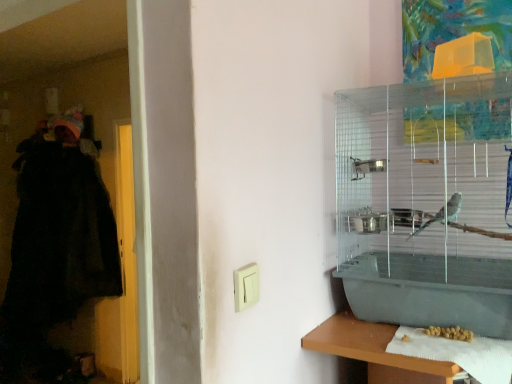
Question: From a real-world perspective, is black fuzzy robe at left over yellow matte seeds at lower right?

Choices:
 (A) yes
 (B) no

Answer: (A)

Question: Does black fuzzy robe at left have a greater width compared to yellow matte seeds at lower right?

Choices:
 (A) no
 (B) yes

Answer: (B)

Question: Does black fuzzy robe at left have a lesser height compared to yellow matte seeds at lower right?

Choices:
 (A) yes
 (B) no

Answer: (B)

Question: Considering the relative positions of black fuzzy robe at left and yellow matte seeds at lower right in the image provided, is black fuzzy robe at left to the right of yellow matte seeds at lower right from the viewer's perspective?

Choices:
 (A) yes
 (B) no

Answer: (B)

Question: Can you confirm if black fuzzy robe at left is smaller than yellow matte seeds at lower right?

Choices:
 (A) no
 (B) yes

Answer: (A)

Question: Is white plastic light switch at center taller or shorter than black fuzzy robe at left?

Choices:
 (A) tall
 (B) short

Answer: (B)

Question: Do you think white plastic light switch at center is within black fuzzy robe at left, or outside of it?

Choices:
 (A) outside
 (B) inside

Answer: (A)

Question: In terms of width, does white plastic light switch at center look wider or thinner when compared to black fuzzy robe at left?

Choices:
 (A) wide
 (B) thin

Answer: (B)

Question: Is white plastic light switch at center in front of or behind black fuzzy robe at left in the image?

Choices:
 (A) behind
 (B) front

Answer: (B)

Question: Is white paper towel at lower right wider or thinner than clear plastic birdcage at upper right?

Choices:
 (A) thin
 (B) wide

Answer: (A)

Question: Is white paper towel at lower right in front of or behind clear plastic birdcage at upper right in the image?

Choices:
 (A) front
 (B) behind

Answer: (A)

Question: In terms of size, does white paper towel at lower right appear bigger or smaller than clear plastic birdcage at upper right?

Choices:
 (A) big
 (B) small

Answer: (B)

Question: From a real-world perspective, is white paper towel at lower right positioned above or below clear plastic birdcage at upper right?

Choices:
 (A) below
 (B) above

Answer: (A)

Question: In the image, is white plastic light switch at center positioned in front of or behind white paper towel at lower right?

Choices:
 (A) behind
 (B) front

Answer: (B)

Question: Is white plastic light switch at center taller or shorter than white paper towel at lower right?

Choices:
 (A) tall
 (B) short

Answer: (A)